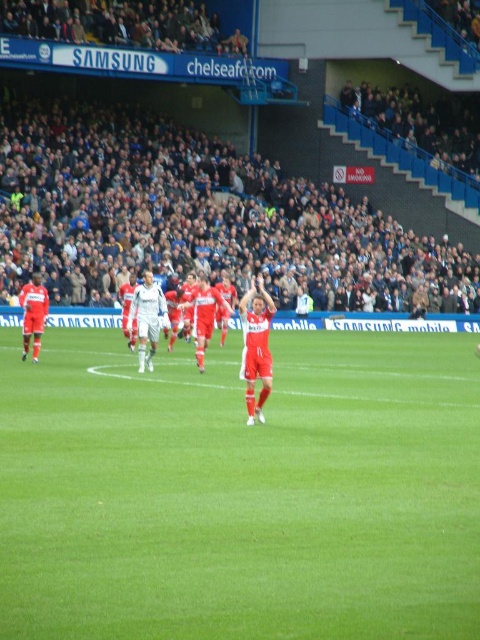
Question: Considering the relative positions of green grass at center and white matte soccer player at center in the image provided, where is green grass at center located with respect to white matte soccer player at center?

Choices:
 (A) right
 (B) left

Answer: (A)

Question: Which point is closer to the camera taking this photo?

Choices:
 (A) pos(144,316)
 (B) pos(207,264)
 (C) pos(322,413)

Answer: (C)

Question: Which point appears closest to the camera in this image?

Choices:
 (A) (315, 305)
 (B) (158, 317)

Answer: (B)

Question: Does dark gray concrete stadium seating at upper center appear under white matte soccer player at center?

Choices:
 (A) yes
 (B) no

Answer: (B)

Question: Which point is closer to the camera?

Choices:
 (A) (144, 356)
 (B) (381, 477)

Answer: (B)

Question: Does green grass at center have a lesser width compared to dark gray concrete stadium seating at upper center?

Choices:
 (A) yes
 (B) no

Answer: (A)